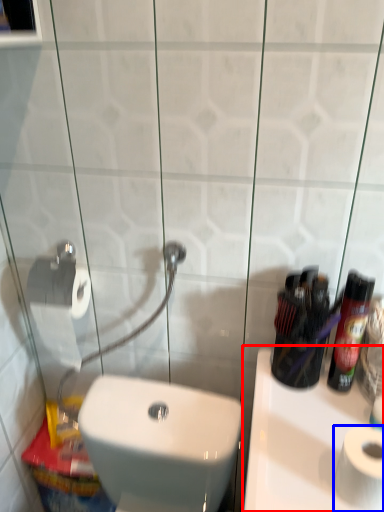
Question: Among these objects, which one is nearest to the camera, sink (highlighted by a red box) or toilet paper (highlighted by a blue box)?

Choices:
 (A) sink
 (B) toilet paper

Answer: (A)